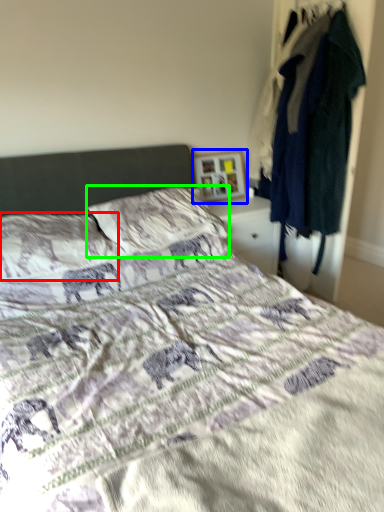
Question: Considering the real-world distances, which object is closest to pillow (highlighted by a red box)? picture frame (highlighted by a blue box) or pillow (highlighted by a green box).

Choices:
 (A) picture frame
 (B) pillow

Answer: (B)